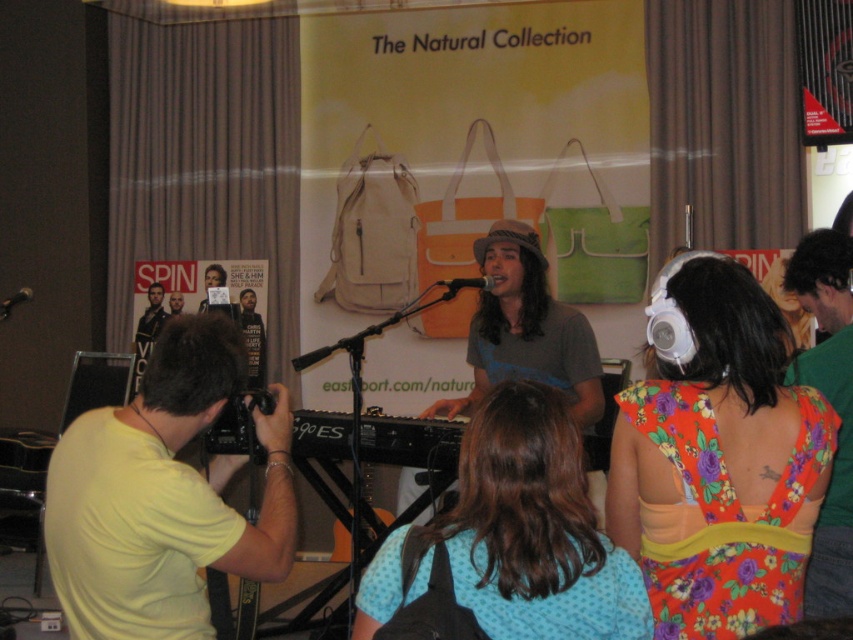
Does yellow matte shirt at left have a lesser width compared to blue polka dot shirt at center?

No, yellow matte shirt at left is not thinner than blue polka dot shirt at center.

Which of these two, yellow matte shirt at left or blue polka dot shirt at center, stands shorter?

blue polka dot shirt at center

The width and height of the screenshot is (853, 640). Describe the element at coordinates (163, 497) in the screenshot. I see `yellow matte shirt at left` at that location.

Find the location of `yellow matte shirt at left`. yellow matte shirt at left is located at coordinates (163, 497).

Can you confirm if yellow matte shirt at left is positioned below matte black jacket at center?

Correct, yellow matte shirt at left is located below matte black jacket at center.

Between yellow matte shirt at left and matte black jacket at center, which one appears on the right side from the viewer's perspective?

yellow matte shirt at left is more to the right.

Which is behind, point (170, 448) or point (135, 358)?

Point (135, 358)

The height and width of the screenshot is (640, 853). Identify the location of yellow matte shirt at left. (163, 497).

Can you confirm if blue polka dot shirt at center is positioned to the right of matte black jacket at center?

Yes, blue polka dot shirt at center is to the right of matte black jacket at center.

Who is lower down, blue polka dot shirt at center or matte black jacket at center?

Positioned lower is blue polka dot shirt at center.

You are a GUI agent. You are given a task and a screenshot of the screen. Output one action in this format:
    pyautogui.click(x=<x>, y=<y>)
    Task: Click on the blue polka dot shirt at center
    
    Given the screenshot: What is the action you would take?
    pyautogui.click(x=518, y=534)